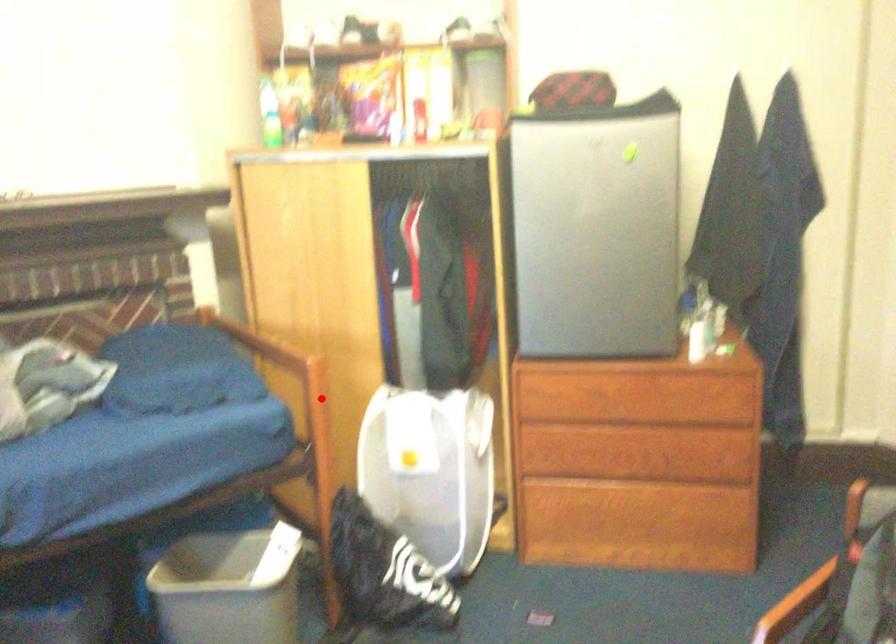
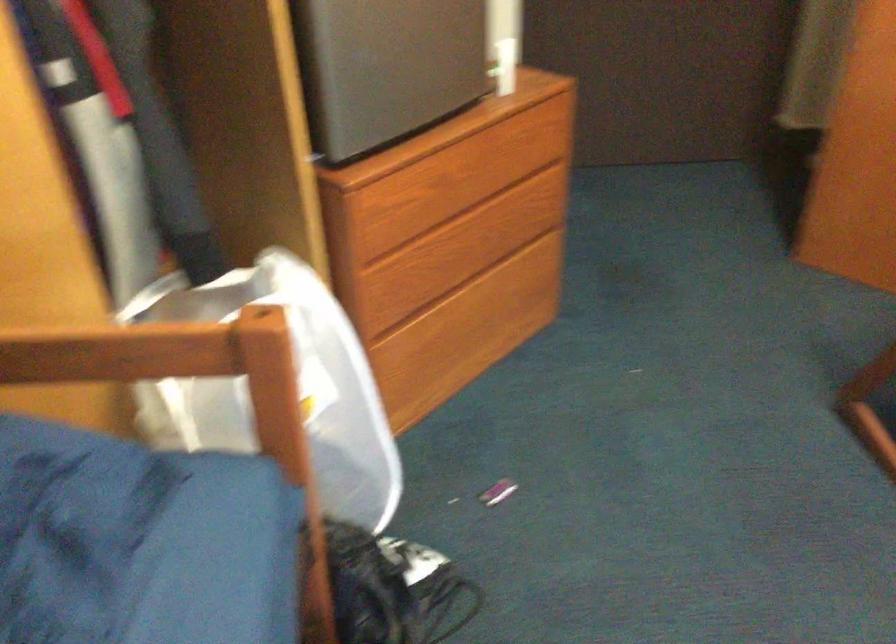
Locate, in the second image, the point that corresponds to the highlighted location in the first image.

(297, 386)